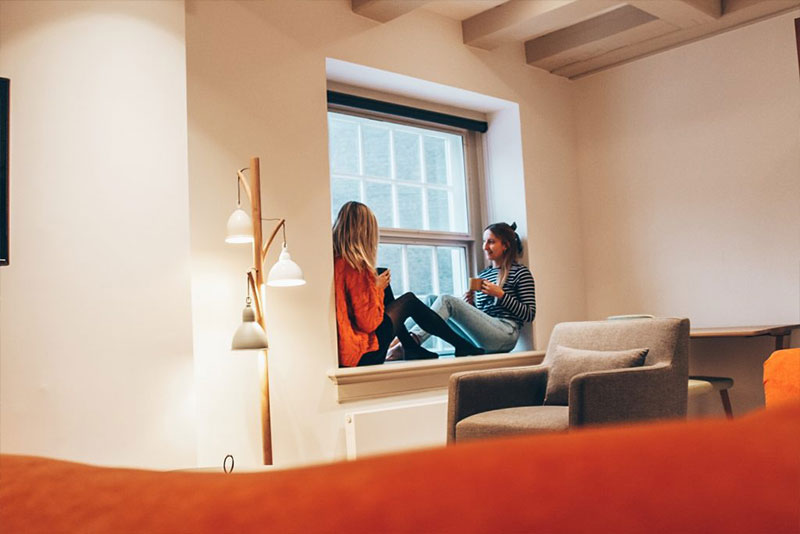
Where is `cups`? The image size is (800, 534). cups is located at coordinates pyautogui.click(x=474, y=280), pyautogui.click(x=377, y=268).